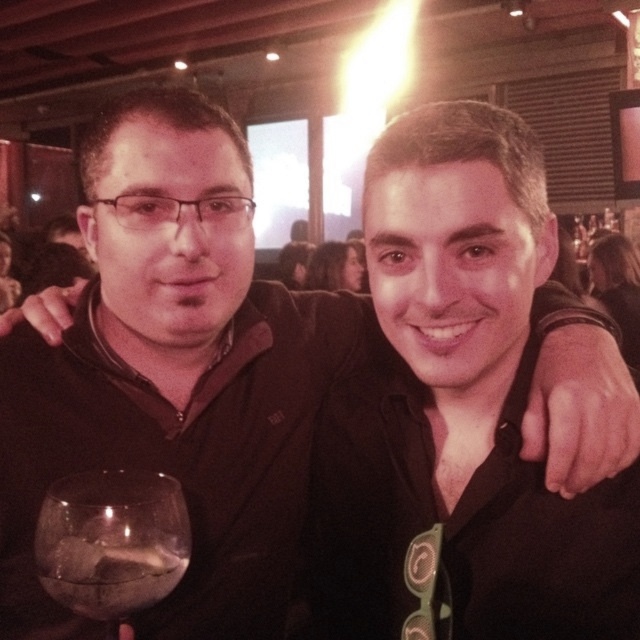
You are at a party and see two glasses on the table. The transparent glass at lower left and the translucent glass wine at lower left. Which one has a larger opening?

The transparent glass at lower left might be wider than translucent glass wine at lower left, so it likely has a larger opening.